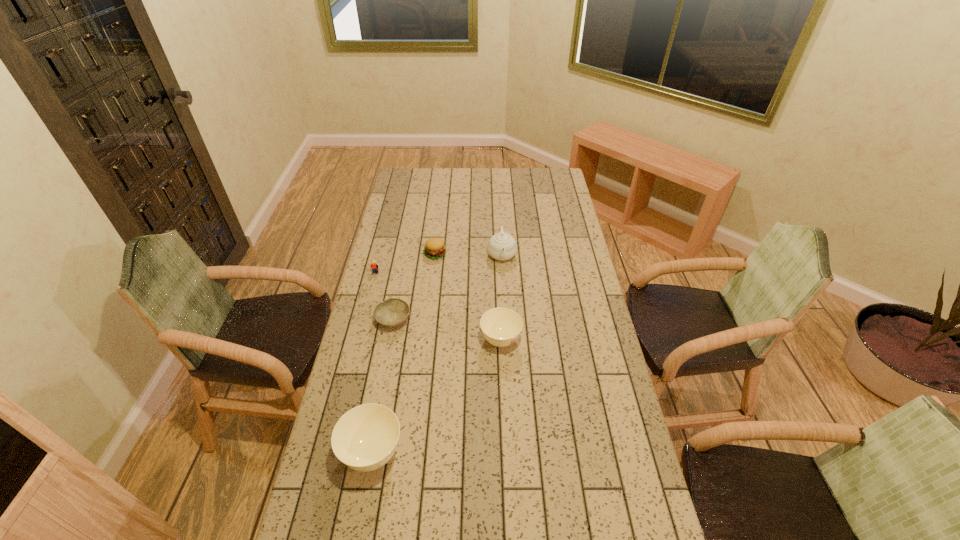
What are the coordinates of `free space between the nearest object and the bowl` in the screenshot? It's located at (383, 387).

Identify the location of free spot between the left sugar bowl and the shortest object. (383, 387).

Find the location of a particular element. free spot between the fifth tallest object and the Lego is located at coordinates (405, 264).

What are the coordinates of `object that is the third closest to the chinaware` in the screenshot? It's located at (392, 312).

Locate which object is the fifth closest to the Lego. Please provide its 2D coordinates. Your answer should be formatted as a tuple, i.e. [(x, y)], where the tuple contains the x and y coordinates of a point satisfying the conditions above.

[(365, 438)]

This screenshot has width=960, height=540. I want to click on vacant area in the image that satisfies the following two spatial constraints: 1. on the back side of the nearer sugar bowl; 2. on the right side of the farther sugar bowl, so click(394, 340).